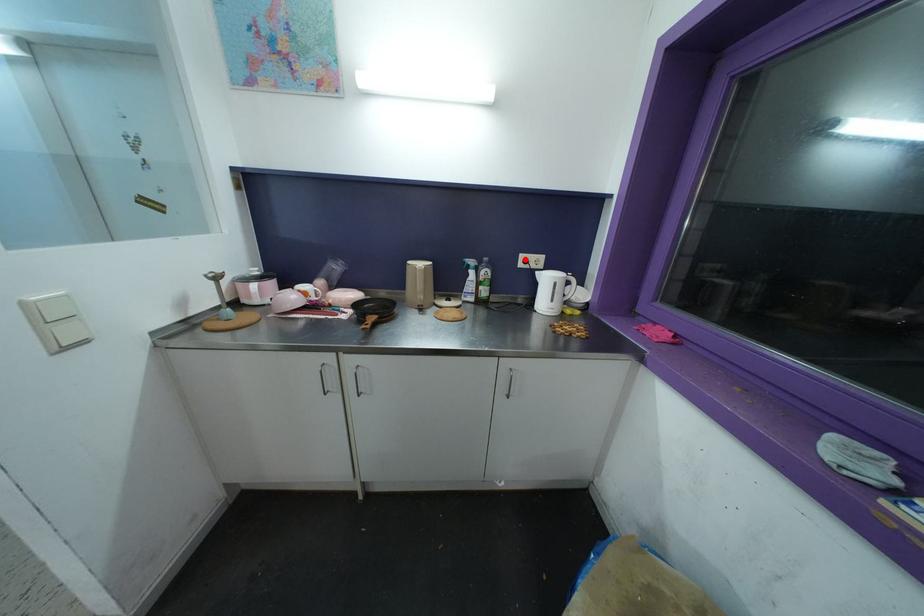
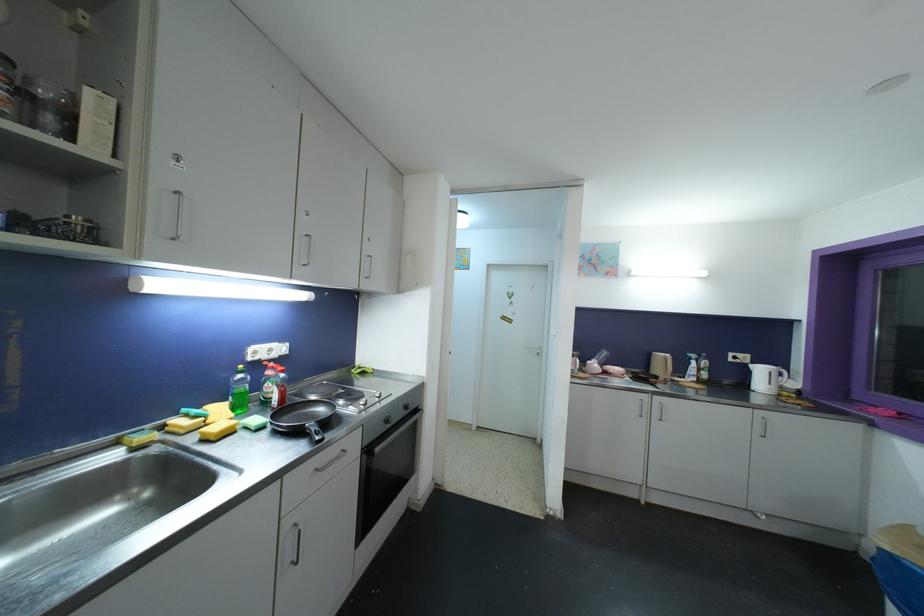
Where in the second image is the point corresponding to the highlighted location from the first image?

(734, 357)